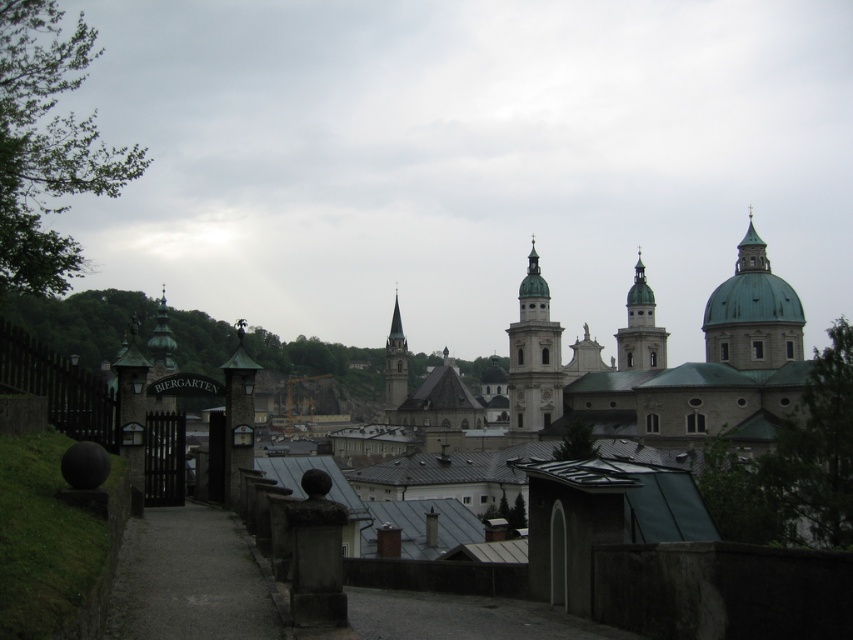
You are a tourist carrying a large backpack and need to walk from the entrance to the BIERGARTEN gate. You see the gray gravel path at lower left and the smooth gray stone tower at center. Which path should you take to reach the BIERGARTEN gate more easily?

The gray gravel path at lower left has a smaller size compared to the smooth gray stone tower at center, so it is narrower and might be harder to navigate with a large backpack. The smooth gray stone tower at center is larger and likely provides a wider path or clearer route towards the BIERGARTEN gate.

You are standing at the entrance of the BIERGARTEN gate and want to take a photo of the smooth white tower at center. Which direction should you face to capture it in your view?

The smooth white tower at center is located at point (640, 326), so you should face towards the center of the image to capture it in your view.